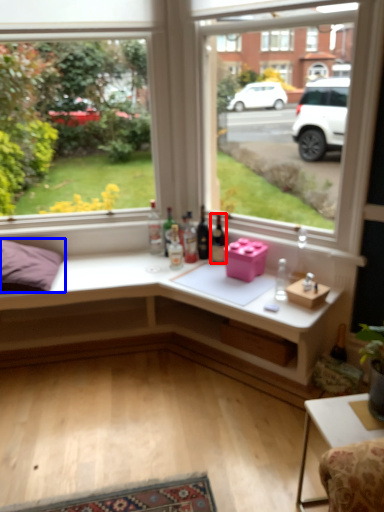
Question: Among these objects, which one is farthest to the camera, bottle (highlighted by a red box) or pillow (highlighted by a blue box)?

Choices:
 (A) bottle
 (B) pillow

Answer: (A)